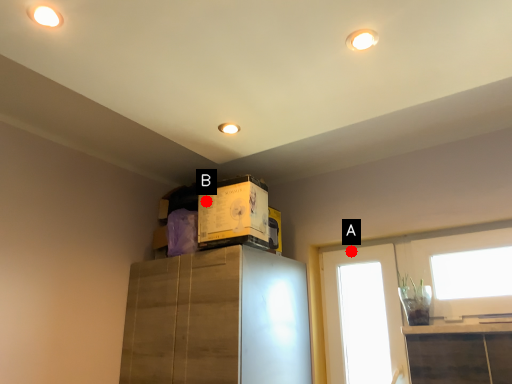
Question: Two points are circled on the image, labeled by A and B beside each circle. Which point appears farthest from the camera in this image?

Choices:
 (A) A is further
 (B) B is further

Answer: (A)